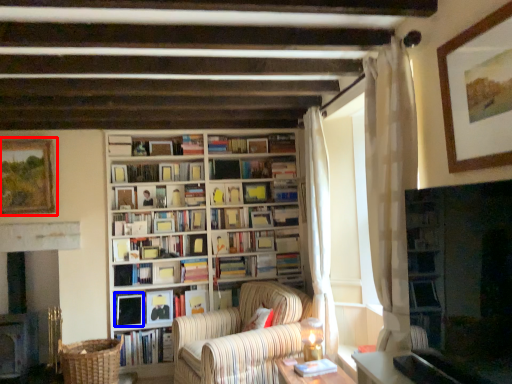
Question: Which of the following is the farthest to the observer, picture frame (highlighted by a red box) or book (highlighted by a blue box)?

Choices:
 (A) picture frame
 (B) book

Answer: (B)